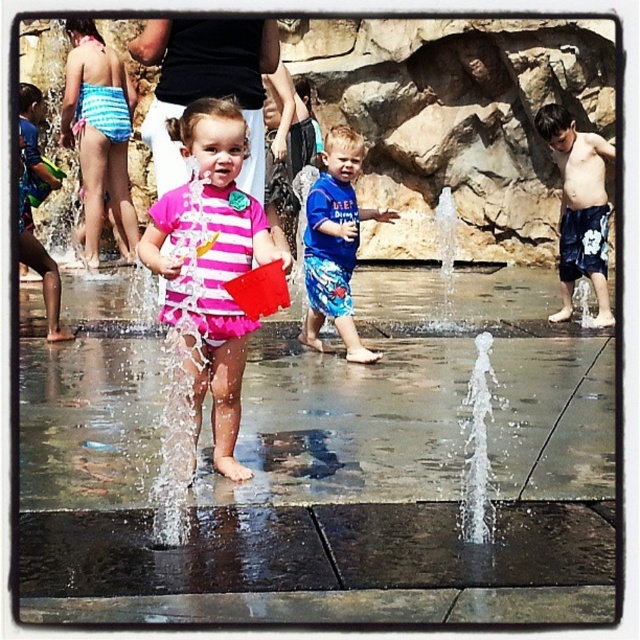
In the scene shown: Who is shorter, blue striped swimsuit at upper left or blue printed shorts at center?

blue printed shorts at center is shorter.

Where is `blue striped swimsuit at upper left`? Image resolution: width=640 pixels, height=640 pixels. blue striped swimsuit at upper left is located at coordinates (99, 132).

What do you see at coordinates (99, 132) in the screenshot?
I see `blue striped swimsuit at upper left` at bounding box center [99, 132].

Image resolution: width=640 pixels, height=640 pixels. Identify the location of blue striped swimsuit at upper left. (99, 132).

Is point (212, 420) farther from viewer compared to point (330, 179)?

No, (212, 420) is closer to viewer.

Which is more to the right, pink matte swimsuit at center or blue printed shorts at center?

blue printed shorts at center

Measure the distance between pink matte swimsuit at center and camera.

pink matte swimsuit at center is 75.10 feet away from camera.

The image size is (640, 640). I want to click on pink matte swimsuit at center, so click(211, 262).

Is point (252, 257) in front of point (81, 108)?

That is True.

Find the location of `pink matte swimsuit at center`. pink matte swimsuit at center is located at coordinates (211, 262).

What do you see at coordinates (211, 262) in the screenshot? The width and height of the screenshot is (640, 640). I see `pink matte swimsuit at center` at bounding box center [211, 262].

Identify the location of pink matte swimsuit at center. This screenshot has width=640, height=640. [x=211, y=262].